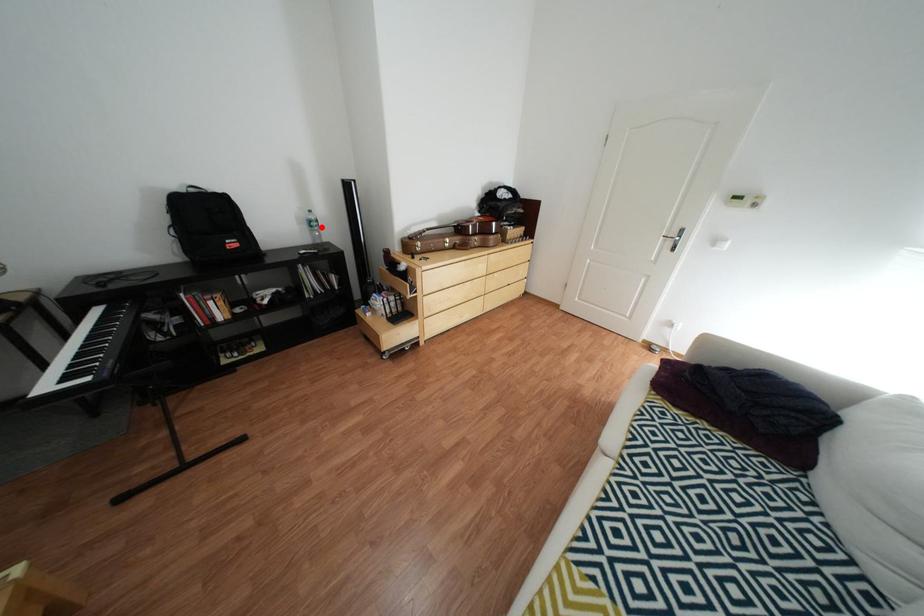
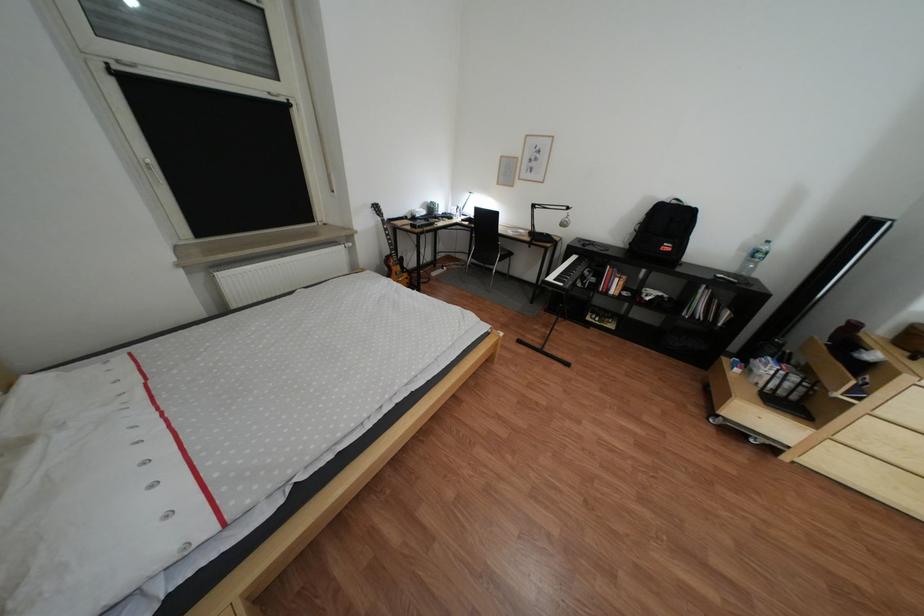
Locate, in the second image, the point that corresponds to the highlighted location in the first image.

(760, 256)